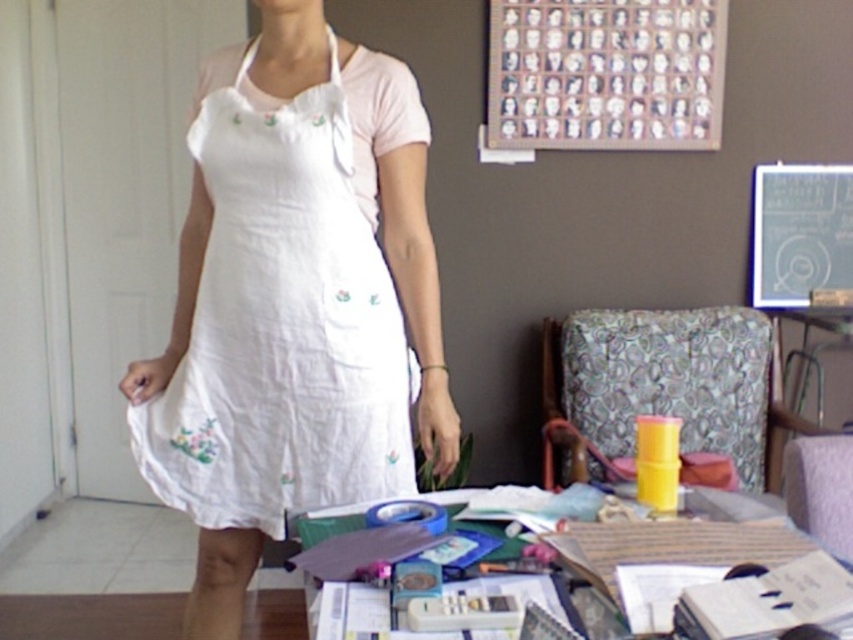
Is wooden frame at upper center above blackboard at upper center?

Yes, wooden frame at upper center is above blackboard at upper center.

Who is more forward, [523,102] or [819,257]?

Point [523,102] is more forward.

The image size is (853, 640). Identify the location of wooden frame at upper center. (605, 74).

Between white cotton dress at center and wooden frame at upper center, which one appears on the left side from the viewer's perspective?

From the viewer's perspective, white cotton dress at center appears more on the left side.

Where is `white cotton dress at center`? The image size is (853, 640). white cotton dress at center is located at coordinates (288, 307).

What do you see at coordinates (288, 307) in the screenshot? I see `white cotton dress at center` at bounding box center [288, 307].

Is white cotton dress at center positioned at the back of blackboard at upper center?

No, white cotton dress at center is in front of blackboard at upper center.

Where is `white cotton dress at center`? This screenshot has width=853, height=640. white cotton dress at center is located at coordinates (288, 307).

Where is `white cotton dress at center`? white cotton dress at center is located at coordinates (288, 307).